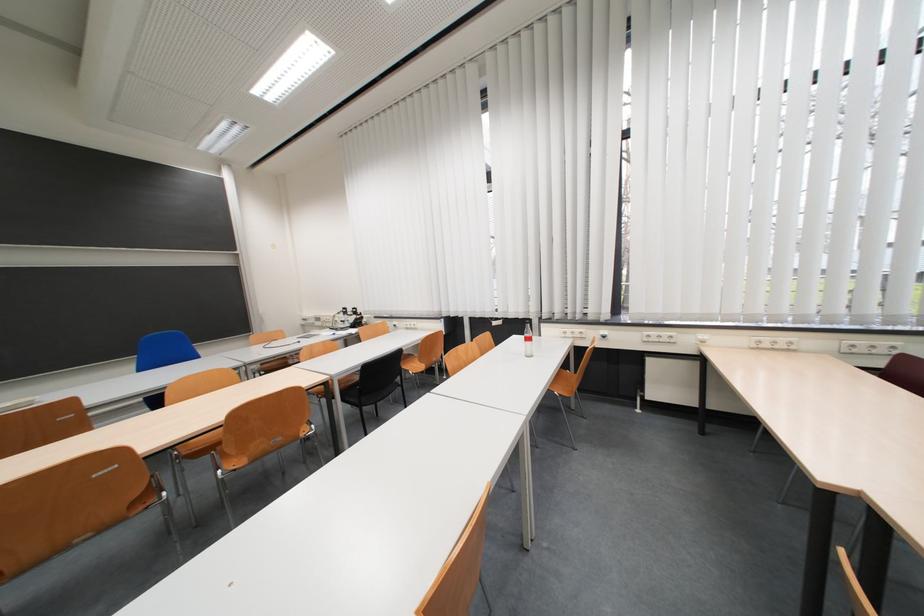
Where would you plugging in the white power outlet? Please return your answer as a coordinate pair (x, y).

(772, 342)